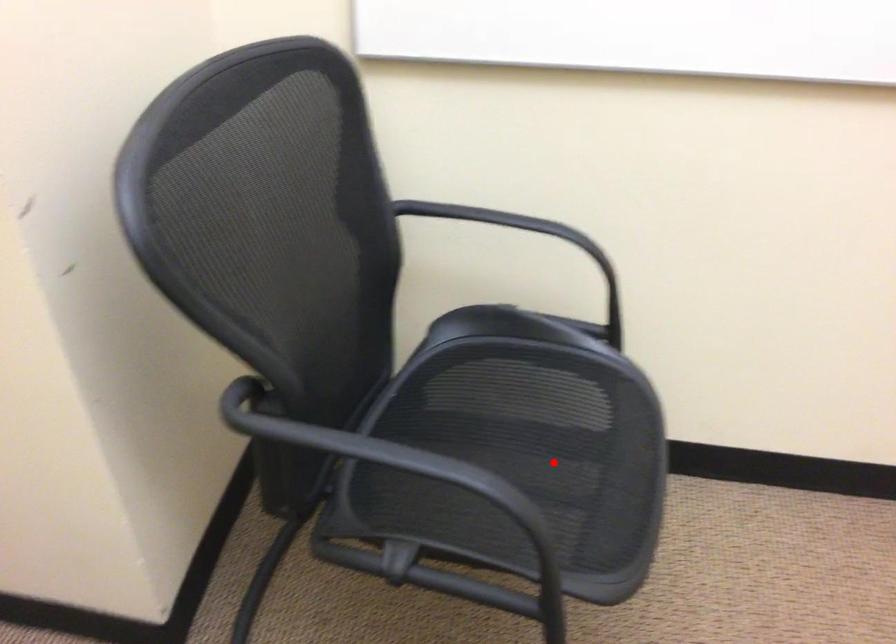
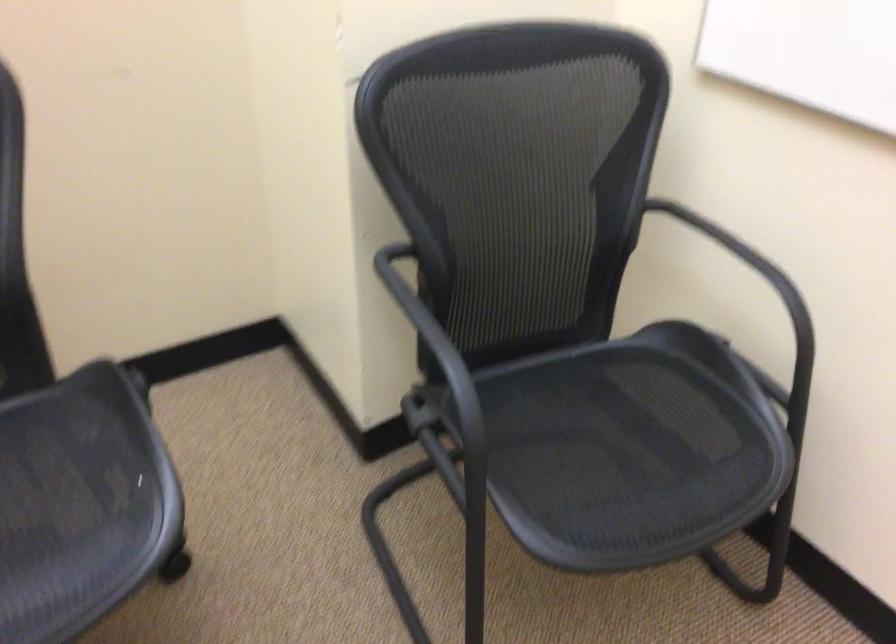
Locate, in the second image, the point that corresponds to the highlighted location in the first image.

(626, 453)